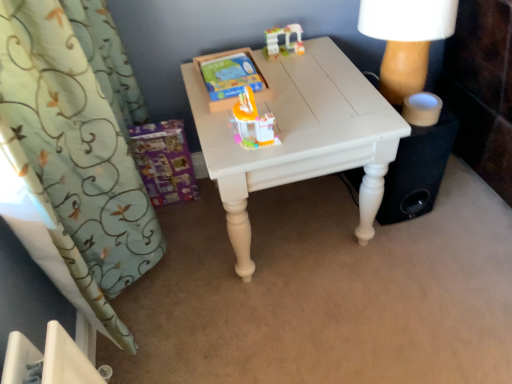
Where is `vacant space to the right of green floral fabric curtain at left`? The height and width of the screenshot is (384, 512). vacant space to the right of green floral fabric curtain at left is located at coordinates (242, 292).